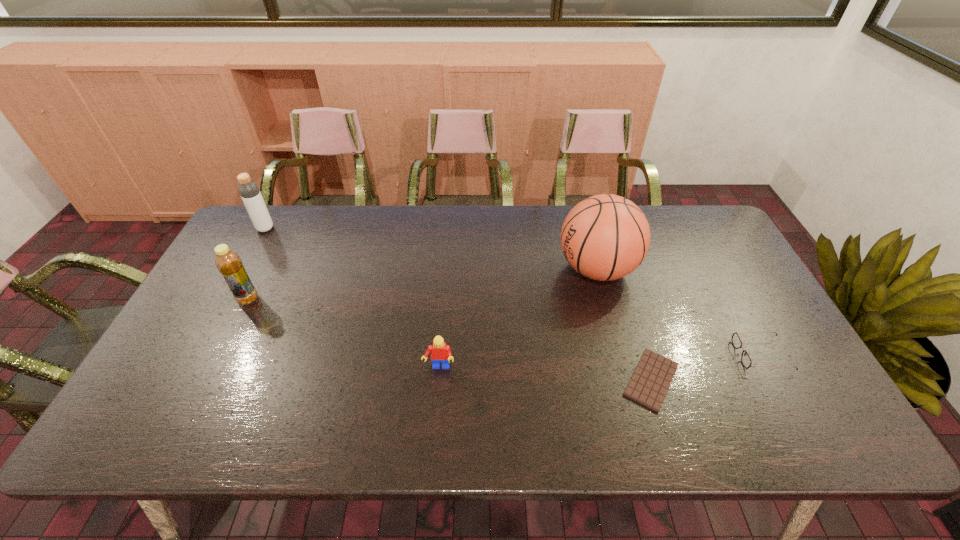
I want to click on vacant space that is in between the chocolate bar and the basketball, so point(624,324).

You are a GUI agent. You are given a task and a screenshot of the screen. Output one action in this format:
    pyautogui.click(x=<x>, y=<y>)
    Task: Click on the free point between the third object from left to right and the fifth object from right to left
    This screenshot has width=960, height=540.
    Given the screenshot: What is the action you would take?
    pyautogui.click(x=344, y=334)

Where is `free point between the third object from left to right and the tallest object`? free point between the third object from left to right and the tallest object is located at coordinates (517, 319).

Locate an element on the screen. Image resolution: width=960 pixels, height=540 pixels. free point between the chocolate bar and the sunglasses is located at coordinates (707, 367).

At what (x,y) coordinates should I click in order to perform the action: click on empty location between the rightmost object and the farthest object. Please return your answer as a coordinate pair (x, y). This screenshot has height=540, width=960. Looking at the image, I should click on (514, 292).

At what (x,y) coordinates should I click in order to perform the action: click on vacant region between the third shortest object and the chocolate bar. Please return your answer as a coordinate pair (x, y). Looking at the image, I should click on (545, 374).

Where is `free point between the nearer bottle and the leftmost object`? The image size is (960, 540). free point between the nearer bottle and the leftmost object is located at coordinates [256, 264].

The height and width of the screenshot is (540, 960). Identify the location of free space that is in between the tallest object and the shortest object. (624, 324).

Locate an element on the screen. Image resolution: width=960 pixels, height=540 pixels. unoccupied area between the second object from left to right and the sunglasses is located at coordinates (505, 327).

You are a GUI agent. You are given a task and a screenshot of the screen. Output one action in this format:
    pyautogui.click(x=<x>, y=<y>)
    Task: Click on the object that ranks as the fourth closest to the sunglasses
    
    Given the screenshot: What is the action you would take?
    pyautogui.click(x=229, y=264)